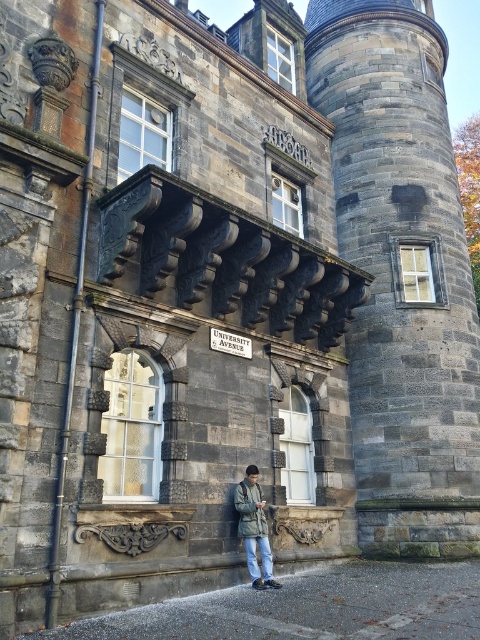
You are standing on the sidewalk in front of the historic stone building. You want to take a photo of the dark gray stone tower at center from a distance that allows the entire tower to fit in the frame. Your camera has a maximum focal length of 50mm and a sensor size of 36mm. According to the rule of thumb that the minimum distance to capture an object of height H meters is given by distance D meters equals H multiplied by 100 divided by 36, what is the minimum distance you need to be from the dark gray st

The dark gray stone tower at center and viewer are 35.65 meters apart. Using the formula D equals H multiplied by 100 divided by 36, we can solve for H by rearranging the formula to H equals D multiplied by 36 divided by 100. Plugging in the given distance of 35.65 meters, H equals 35.65 multiplied by 36 divided by 100, which equals approximately 12.83 meters. Therefore, the tower is about 12.83 meters tall. Since the current distance of 35.65 meters is greater than the minimum required distance of 12.83, a

You are an architect analyzing the building layout. The dark gray stone tower at center is part of the building. Where is it located in terms of coordinates on the image?

The dark gray stone tower at center is located at the coordinates point (402, 275).

You are a photographer standing in front of the historic stone building on UNIVERSITY AVENUE. You want to capture both the dark gray stone tower at center and the green matte jacket at center in your shot. Which object will appear wider in the photo?

The dark gray stone tower at center will appear wider in the photo because its width is larger than that of the green matte jacket at center.